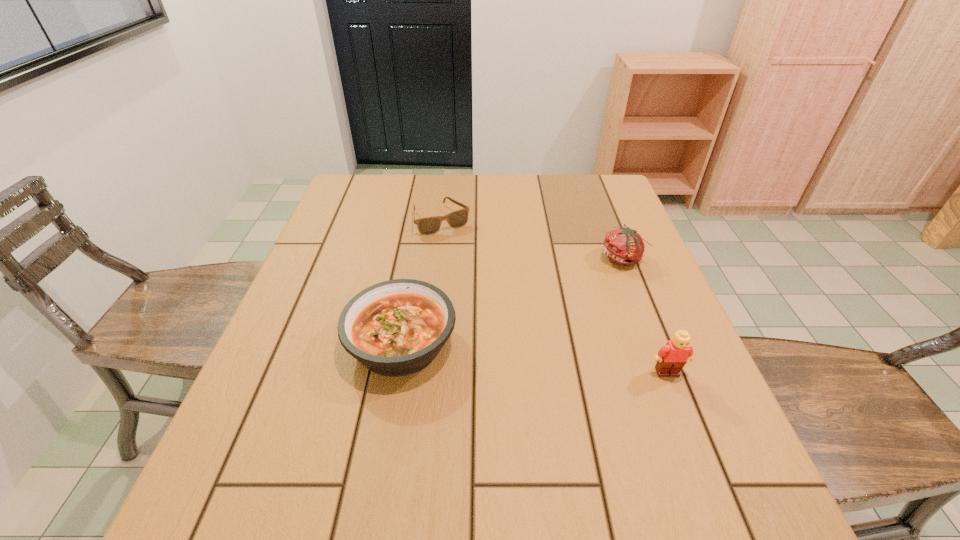
Locate an element on the screen. The image size is (960, 540). stew is located at coordinates (394, 328).

The height and width of the screenshot is (540, 960). Identify the location of the tallest object. [672, 357].

Locate an element on the screen. This screenshot has height=540, width=960. the second farthest object is located at coordinates (624, 246).

Locate an element on the screen. This screenshot has width=960, height=540. the farthest object is located at coordinates (430, 225).

Locate an element on the screen. Image resolution: width=960 pixels, height=540 pixels. sunglasses is located at coordinates (430, 225).

Locate an element on the screen. Image resolution: width=960 pixels, height=540 pixels. vacant region located 0.070m on the right of the stew is located at coordinates (490, 344).

What are the coordinates of `free region located on the face of the Lego` in the screenshot? It's located at (691, 435).

Where is `free location located on the front-facing side of the tomato`? The image size is (960, 540). free location located on the front-facing side of the tomato is located at coordinates (581, 291).

What are the coordinates of `vacant area situated 0.390m on the front-facing side of the tomato` in the screenshot? It's located at (504, 352).

Where is `vacant space situated on the front-facing side of the tomato`? vacant space situated on the front-facing side of the tomato is located at coordinates (573, 296).